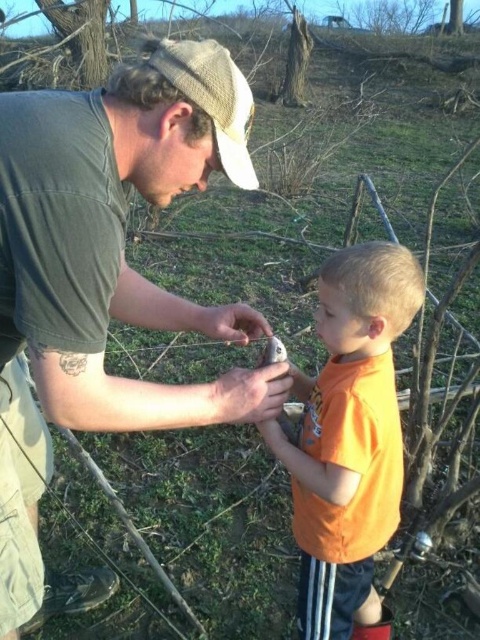
Consider the image. You are a photographer trying to capture a candid shot of the two people in the scene. You want to ensure that both the matte green shirt at center and the knitted beige cap at upper center are clearly visible in the frame. Based on their positions, which object should you focus on first to ensure both are in focus?

The knitted beige cap at upper center is above the matte green shirt at center. To ensure both are in focus, focus on the knitted beige cap at upper center first since it is farther away from the camera, allowing the matte green shirt at center to remain in the depth of field.

You are a photographer trying to capture a closeup shot of the matte plastic hand at center. The matte green shirt at center is blocking part of the view. Can you estimate whether the shirt is wider than the hand, making it harder to frame the shot?

The matte green shirt at center is wider than the matte plastic hand at center, so it is likely blocking the view more due to its larger width.